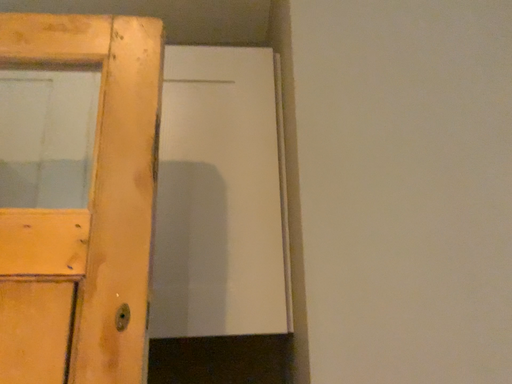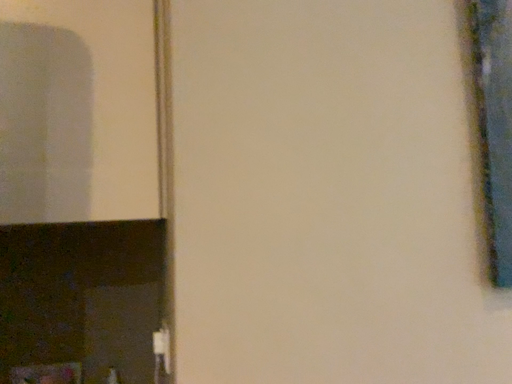
Question: Which way did the camera rotate in the video?

Choices:
 (A) rotated upward
 (B) rotated downward

Answer: (B)